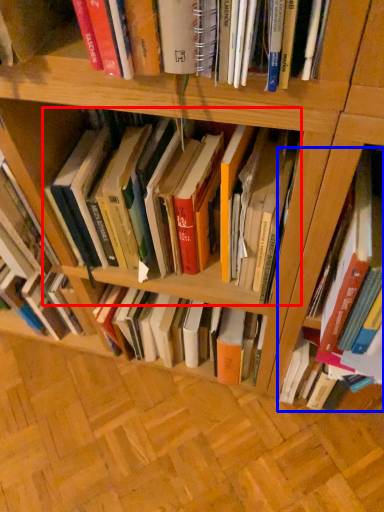
Question: Which point is closer to the camera, book (highlighted by a red box) or book (highlighted by a blue box)?

Choices:
 (A) book
 (B) book

Answer: (B)